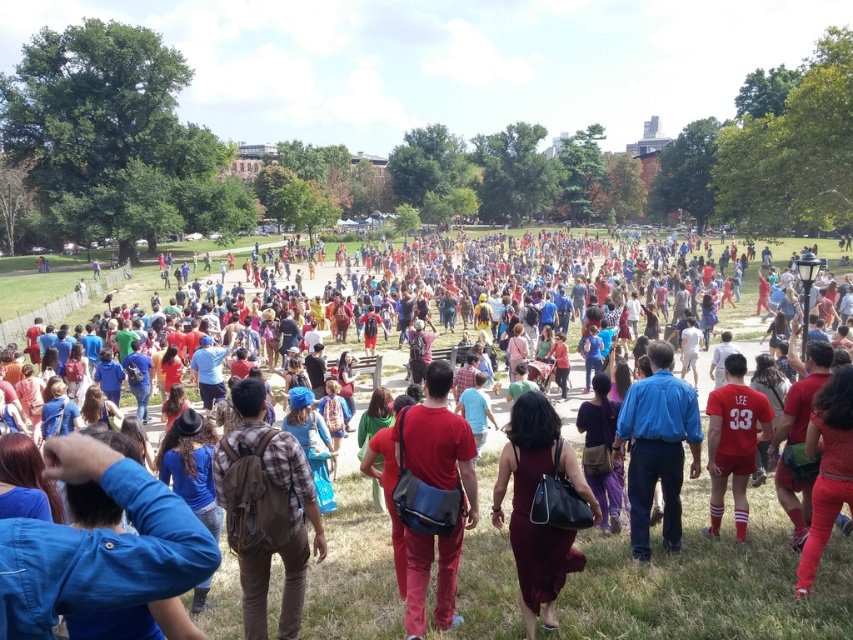
You are a photographer trying to capture a candid shot of both the matte red pants at center and the burgundy satin dress at center. Given that your camera has a maximum focus range of 2 meters, will you be able to include both subjects in the same frame without moving your position?

The distance between the matte red pants at center and the burgundy satin dress at center is 2.35 meters, which exceeds the camera maximum focus range of 2 meters. Therefore, you cannot include both subjects in the same frame without moving your position.

You are a photographer at the park and want to capture a person wearing both a matte red shirt at center and matte red pants at center. Which piece of clothing will appear higher in your photo?

The matte red shirt at center is located above the matte red pants at center, so the shirt will appear higher in the photo.

You are standing at the entrance of the park and want to find someone wearing the matte red pants at center. According to the coordinates provided, in which direction should you look to locate them?

The matte red pants at center is located at point 0.764 on the x axis and 0.515 on the y axis, so you should look towards the right side of the image since the x coordinate is higher than 0.5, and slightly towards the center vertically since the y coordinate is around 0.5.